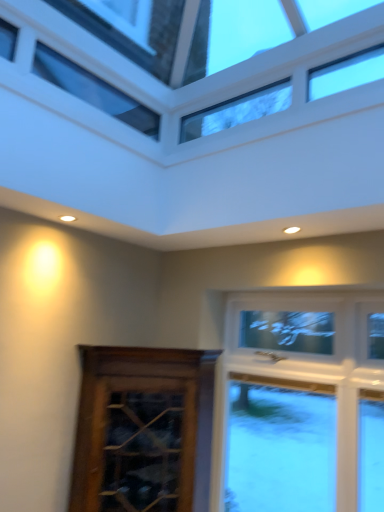
What is the approximate height of transparent glass window at upper center?

It is 1.34 inches.

Identify the location of transparent glass window at upper center. The width and height of the screenshot is (384, 512). (172, 53).

What do you see at coordinates (172, 53) in the screenshot?
I see `transparent glass window at upper center` at bounding box center [172, 53].

Identify the location of brown wooden cabinet at lower left. Image resolution: width=384 pixels, height=512 pixels. (143, 430).

Measure the distance between brown wooden cabinet at lower left and camera.

brown wooden cabinet at lower left and camera are 2.01 meters apart from each other.

Image resolution: width=384 pixels, height=512 pixels. What do you see at coordinates (143, 430) in the screenshot?
I see `brown wooden cabinet at lower left` at bounding box center [143, 430].

The width and height of the screenshot is (384, 512). I want to click on transparent glass window at upper center, so click(172, 53).

Can you confirm if brown wooden cabinet at lower left is positioned to the left of transparent glass window at upper center?

Indeed, brown wooden cabinet at lower left is positioned on the left side of transparent glass window at upper center.

In the image, is brown wooden cabinet at lower left positioned in front of or behind transparent glass window at upper center?

brown wooden cabinet at lower left is behind transparent glass window at upper center.

Which is closer to the camera, (192, 489) or (112, 109)?

Clearly, point (192, 489) is closer to the camera than point (112, 109).

From the image's perspective, does brown wooden cabinet at lower left appear lower than transparent glass window at upper center?

Yes, from the image's perspective, brown wooden cabinet at lower left is beneath transparent glass window at upper center.

From a real-world perspective, relative to transparent glass window at upper center, is brown wooden cabinet at lower left vertically above or below?

In terms of real-world spatial position, brown wooden cabinet at lower left is below transparent glass window at upper center.

Considering the relative sizes of brown wooden cabinet at lower left and transparent glass window at upper center in the image provided, is brown wooden cabinet at lower left thinner than transparent glass window at upper center?

Yes.

From the picture: Which of these two, brown wooden cabinet at lower left or transparent glass window at upper center, stands taller?

brown wooden cabinet at lower left.

Is brown wooden cabinet at lower left smaller than transparent glass window at upper center?

No, brown wooden cabinet at lower left is not smaller than transparent glass window at upper center.

Looking at this image, is brown wooden cabinet at lower left inside or outside of transparent glass window at upper center?

brown wooden cabinet at lower left lies outside transparent glass window at upper center.

Is there a large distance between brown wooden cabinet at lower left and transparent glass window at upper center?

Absolutely, brown wooden cabinet at lower left is distant from transparent glass window at upper center.

Consider the image. Is brown wooden cabinet at lower left oriented away from transparent glass window at upper center?

No, brown wooden cabinet at lower left is not facing away from transparent glass window at upper center.

How different are the orientations of brown wooden cabinet at lower left and transparent glass window at upper center in degrees?

89.7 degrees.

Locate an element on the screen. The image size is (384, 512). screen door to the left of transparent glass window at upper center is located at coordinates (143, 430).

Considering the positions of objects transparent glass window at upper center and brown wooden cabinet at lower left in the image provided, who is more to the left, transparent glass window at upper center or brown wooden cabinet at lower left?

From the viewer's perspective, brown wooden cabinet at lower left appears more on the left side.

Which object is closer to the camera taking this photo, transparent glass window at upper center or brown wooden cabinet at lower left?

transparent glass window at upper center.

Is point (252, 30) positioned in front of point (149, 440)?

No, (252, 30) is further to viewer.

In the scene shown: From the image's perspective, is transparent glass window at upper center above or below brown wooden cabinet at lower left?

Clearly, from the image's perspective, transparent glass window at upper center is above brown wooden cabinet at lower left.

From a real-world perspective, is transparent glass window at upper center above or below brown wooden cabinet at lower left?

In terms of real-world spatial position, transparent glass window at upper center is above brown wooden cabinet at lower left.

From the picture: In terms of width, does transparent glass window at upper center look wider or thinner when compared to brown wooden cabinet at lower left?

Considering their sizes, transparent glass window at upper center looks broader than brown wooden cabinet at lower left.

Based on the photo, can you confirm if transparent glass window at upper center is shorter than brown wooden cabinet at lower left?

Correct, transparent glass window at upper center is not as tall as brown wooden cabinet at lower left.

Which of these two, transparent glass window at upper center or brown wooden cabinet at lower left, is smaller?

transparent glass window at upper center.

Based on the photo, is transparent glass window at upper center positioned beyond the bounds of brown wooden cabinet at lower left?

Yes, transparent glass window at upper center is not within brown wooden cabinet at lower left.

In the scene shown: Is transparent glass window at upper center placed right next to brown wooden cabinet at lower left?

transparent glass window at upper center and brown wooden cabinet at lower left are not in contact.

Is transparent glass window at upper center oriented away from brown wooden cabinet at lower left?

No, brown wooden cabinet at lower left is not at the back of transparent glass window at upper center.

What's the angular difference between transparent glass window at upper center and brown wooden cabinet at lower left's facing directions?

The angle between the facing direction of transparent glass window at upper center and the facing direction of brown wooden cabinet at lower left is 89.7 degrees.

Locate an element on the screen. screen door located below the transparent glass window at upper center (from the image's perspective) is located at coordinates (143, 430).

Where is `screen door below the transparent glass window at upper center (from the image's perspective)`? The height and width of the screenshot is (512, 384). screen door below the transparent glass window at upper center (from the image's perspective) is located at coordinates [143, 430].

The width and height of the screenshot is (384, 512). Find the location of `screen door on the left of transparent glass window at upper center`. screen door on the left of transparent glass window at upper center is located at coordinates (143, 430).